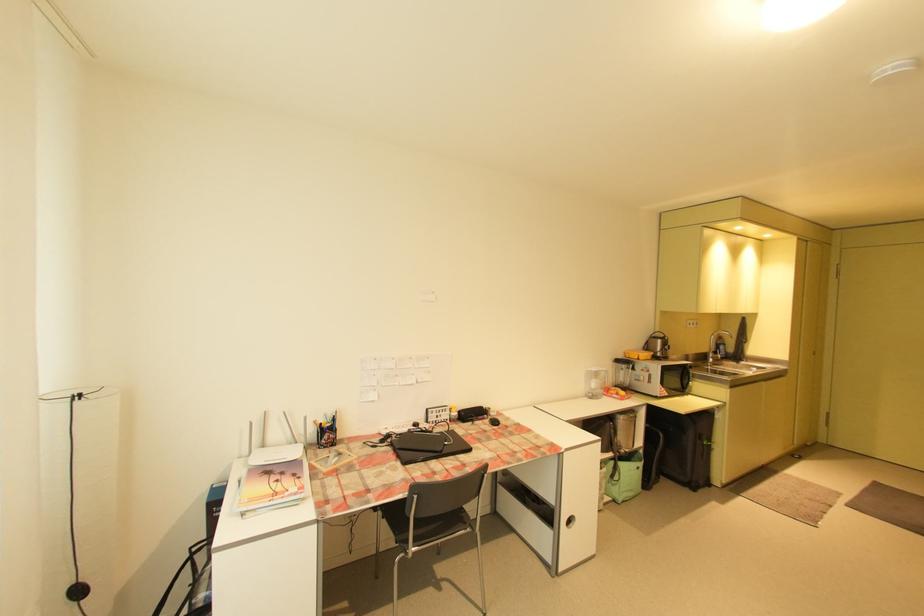
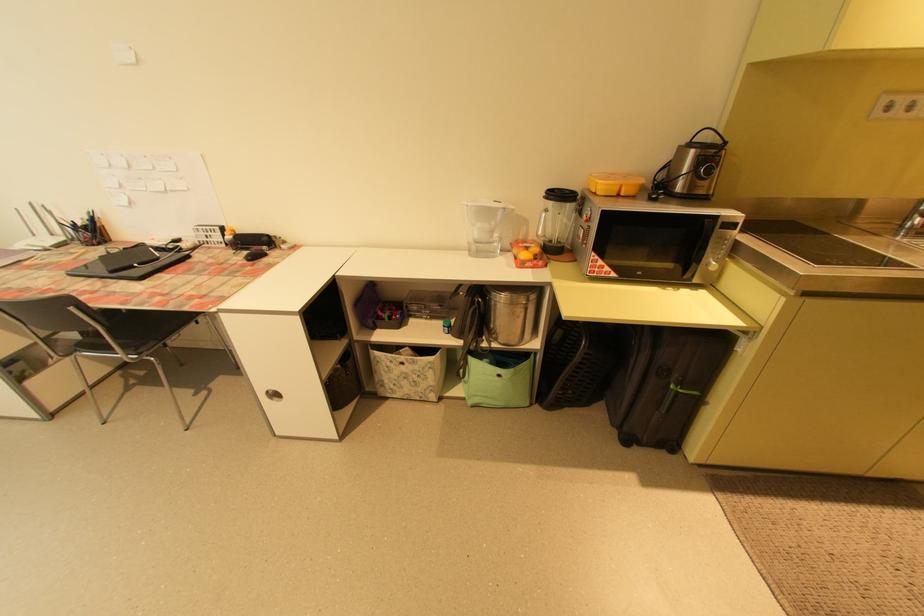
Where in the second image is the point corresponding to pixel 628 448 from the first image?

(503, 339)